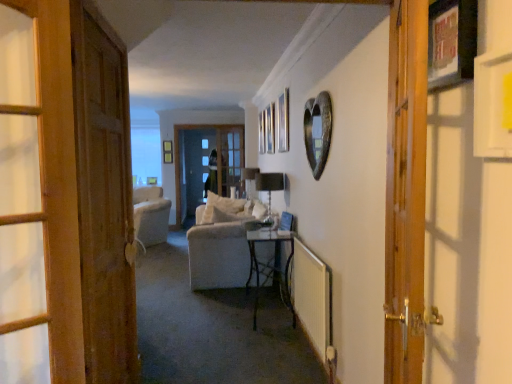
Question: From a real-world perspective, is metallic heart at upper right, arranged as the first picture frame when viewed from the back, positioned over wooden door at right, positioned as the 1th door in right-to-left order, based on gravity?

Choices:
 (A) yes
 (B) no

Answer: (A)

Question: Can wooden door at right, positioned as the 1th door in right-to-left order, be found inside metallic heart at upper right, which is counted as the 2th picture frame, starting from the right?

Choices:
 (A) no
 (B) yes

Answer: (A)

Question: Are metallic heart at upper right, which is counted as the 2th picture frame, starting from the right, and wooden door at right, acting as the 2th door starting from the left, far apart?

Choices:
 (A) no
 (B) yes

Answer: (B)

Question: Is metallic heart at upper right, which is the 2th picture frame in front-to-back order, to the left of wooden door at right, marked as the 1th door in a front-to-back arrangement, from the viewer's perspective?

Choices:
 (A) no
 (B) yes

Answer: (B)

Question: From a real-world perspective, is metallic heart at upper right, which is the 2th picture frame in front-to-back order, physically below wooden door at right, the 2th door viewed from the back?

Choices:
 (A) no
 (B) yes

Answer: (A)

Question: Is metallic heart at upper right, which is the 2th picture frame in front-to-back order, shorter than wooden door at right, the 2th door viewed from the back?

Choices:
 (A) no
 (B) yes

Answer: (B)

Question: Is wooden door at right, marked as the 1th door in a front-to-back arrangement, oriented away from wooden picture frame at upper right, which ranks as the second picture frame in back-to-front order?

Choices:
 (A) yes
 (B) no

Answer: (A)

Question: Is wooden door at right, positioned as the 1th door in right-to-left order, closer to the viewer compared to wooden picture frame at upper right, arranged as the 2th picture frame when viewed from the left?

Choices:
 (A) no
 (B) yes

Answer: (B)

Question: Would you say wooden door at right, acting as the 2th door starting from the left, contains wooden picture frame at upper right, which appears as the first picture frame when viewed from the right?

Choices:
 (A) yes
 (B) no

Answer: (B)

Question: Is wooden door at right, marked as the 1th door in a front-to-back arrangement, not within wooden picture frame at upper right, arranged as the 2th picture frame when viewed from the left?

Choices:
 (A) no
 (B) yes

Answer: (B)

Question: Does wooden door at right, marked as the 1th door in a front-to-back arrangement, have a lesser width compared to wooden picture frame at upper right, which is counted as the first picture frame, starting from the front?

Choices:
 (A) no
 (B) yes

Answer: (A)

Question: From a real-world perspective, does wooden door at right, the 2th door viewed from the back, stand above wooden picture frame at upper right, which ranks as the second picture frame in back-to-front order?

Choices:
 (A) no
 (B) yes

Answer: (A)

Question: Is wooden picture frame at upper right, arranged as the 2th picture frame when viewed from the left, smaller than wooden door at right, marked as the 1th door in a front-to-back arrangement?

Choices:
 (A) yes
 (B) no

Answer: (A)